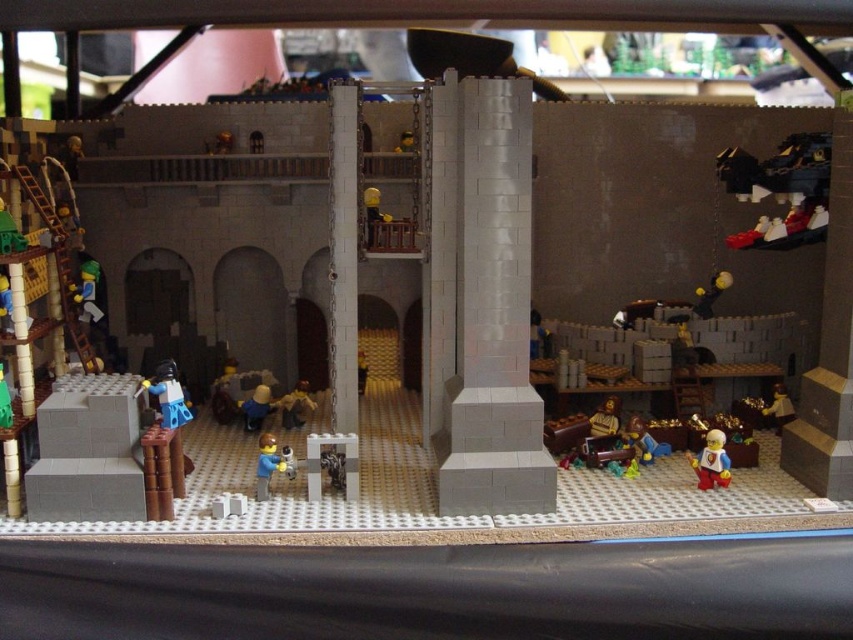
You are a LEGO minifigure trying to pass through the space between the smooth gray column at center and the blue matte figure at center. Can you fit through the gap if you are 2 inches wide?

The smooth gray column at center might be wider than blue matte figure at center, so the gap between them may not be wide enough for a 2 inch wide minifigure to pass through safely. Check the actual width before attempting to move through.

You are a guest approaching the medieval castle in the LEGO model. You notice the white smooth pillar at center and the smooth brown figure at lower right. Which object would you see first as you walk towards the castle?

The white smooth pillar at center would be seen first because it is closer to the viewer than the smooth brown figure at lower right.

You are a visitor to this LEGO castle scene. You notice two blue figures at the center. Which one is closer to you, the blue plastic figure at center or the blue matte figure at center?

The blue plastic figure at center is closer to you because it is positioned in front of the blue matte figure at center.